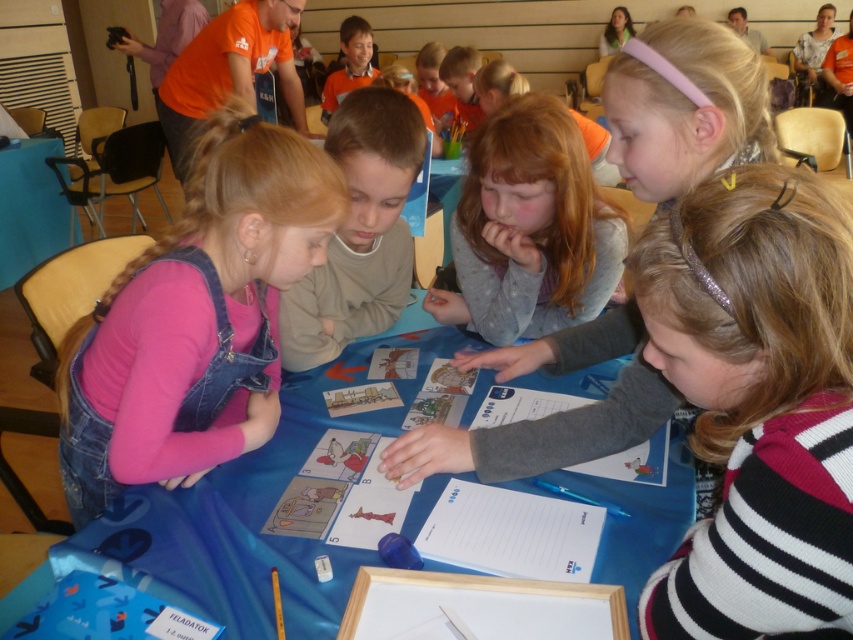
Question: Based on their relative distances, which object is nearer to the blue fabric table at center?

Choices:
 (A) orange matte shirt at upper center
 (B) light brown sweater at center
 (C) pink denim overalls at left

Answer: (C)

Question: Does gray cotton shirt at center have a greater width compared to matte orange shirt at upper center?

Choices:
 (A) yes
 (B) no

Answer: (A)

Question: Can you confirm if blue fabric table at center is positioned to the left of matte orange shirt at upper center?

Choices:
 (A) no
 (B) yes

Answer: (B)

Question: Does pink denim overalls at left have a lesser width compared to light brown sweater at center?

Choices:
 (A) yes
 (B) no

Answer: (B)

Question: Which point is closer to the camera?

Choices:
 (A) light brown sweater at center
 (B) gray cotton shirt at center
 (C) pink denim overalls at left

Answer: (C)

Question: Which object appears closest to the camera in this image?

Choices:
 (A) pink denim overalls at left
 (B) gray cotton shirt at center
 (C) blue fabric table at center
 (D) matte orange shirt at upper center

Answer: (C)